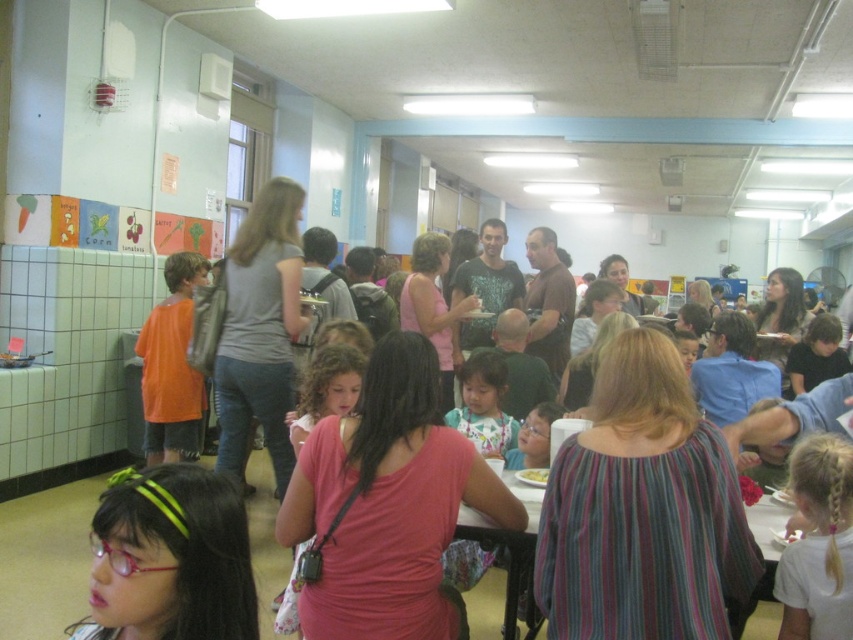
You are standing in the cafeteria and see a point at coordinates (172, 365). What object is this point located on?

The point at coordinates (172, 365) is located on the orange matte shirt at left.